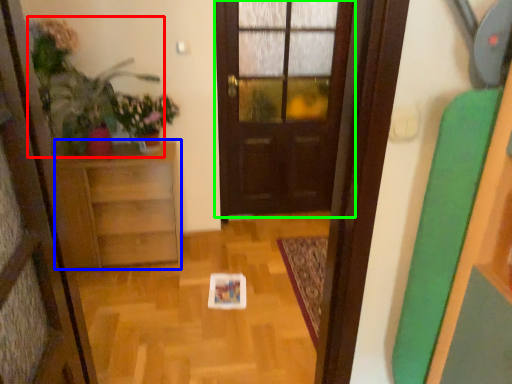
Question: Estimate the real-world distances between objects in this image. Which object is farther from plant (highlighted by a red box), furniture (highlighted by a blue box) or door (highlighted by a green box)?

Choices:
 (A) furniture
 (B) door

Answer: (B)